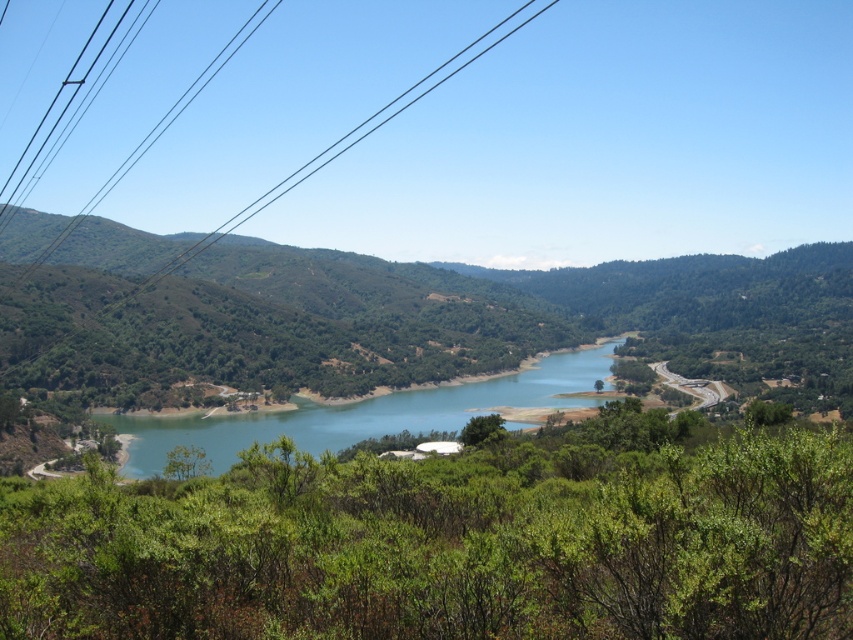
This screenshot has height=640, width=853. I want to click on green water at center, so click(363, 413).

Does green water at center appear on the right side of black wire at upper left?

Indeed, green water at center is positioned on the right side of black wire at upper left.

Does point (135, 422) come behind point (521, 10)?

No, (135, 422) is in front of (521, 10).

This screenshot has height=640, width=853. What are the coordinates of `green water at center` in the screenshot? It's located at (363, 413).